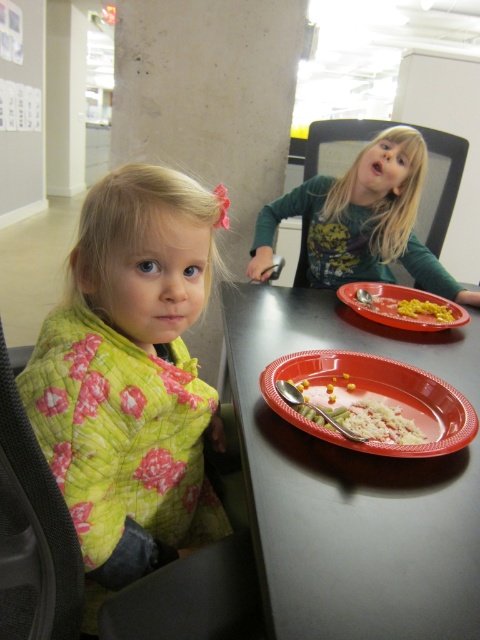
You are a delivery robot that is 40 centimeters wide. You need to move from the entrance to the red plastic table at center. Is there enough space for you to pass through the area between the two children sitting at the table?

The distance of red plastic table at center from camera is 48.55 centimeters. Since the robot is 40 centimeters wide, there is enough space for it to pass through the area between the two children sitting at the table.

You are a chef preparing a dish and need to choose between the white matte rice at center and the yellow matte corn at center based on their size. Which one is wider?

The white matte rice at center is wider than the yellow matte corn at center because its width surpasses the corn.

Please provide the coordinates of the red plastic table at center in the image. The coordinates should be in the format of a point with two decimal places separated by a comma, like 0.5,0.5.

The coordinates of the red plastic table at center are (352, 484).